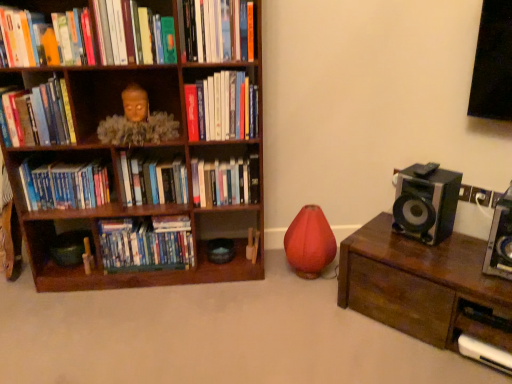
Locate an element on the screen. This screenshot has width=512, height=384. free region under metallic silver speaker at right, the first speaker from the right (from a real-world perspective) is located at coordinates (500, 262).